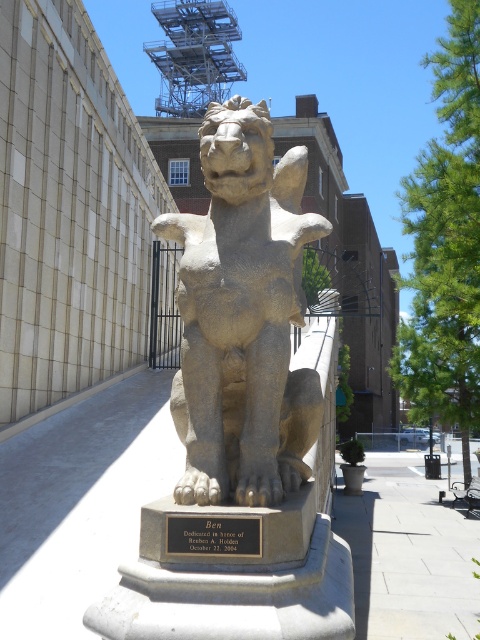
Question: Which point is farther from the camera taking this photo?

Choices:
 (A) (252, 460)
 (B) (180, 541)
 (C) (253, 189)

Answer: (C)

Question: Is bronze plaque at center further to the viewer compared to brown stone paw at lower center?

Choices:
 (A) yes
 (B) no

Answer: (B)

Question: Does stone lion at center appear under brown stone paw at lower center?

Choices:
 (A) yes
 (B) no

Answer: (B)

Question: Where is bronze plaque at center located in relation to brown stone paw at lower center in the image?

Choices:
 (A) left
 (B) right

Answer: (A)

Question: Which of the following is the closest to the observer?

Choices:
 (A) (214, 540)
 (B) (266, 493)

Answer: (A)

Question: Among these objects, which one is farthest from the camera?

Choices:
 (A) stone lion at center
 (B) brown stone paw at lower center
 (C) bronze plaque at center

Answer: (A)